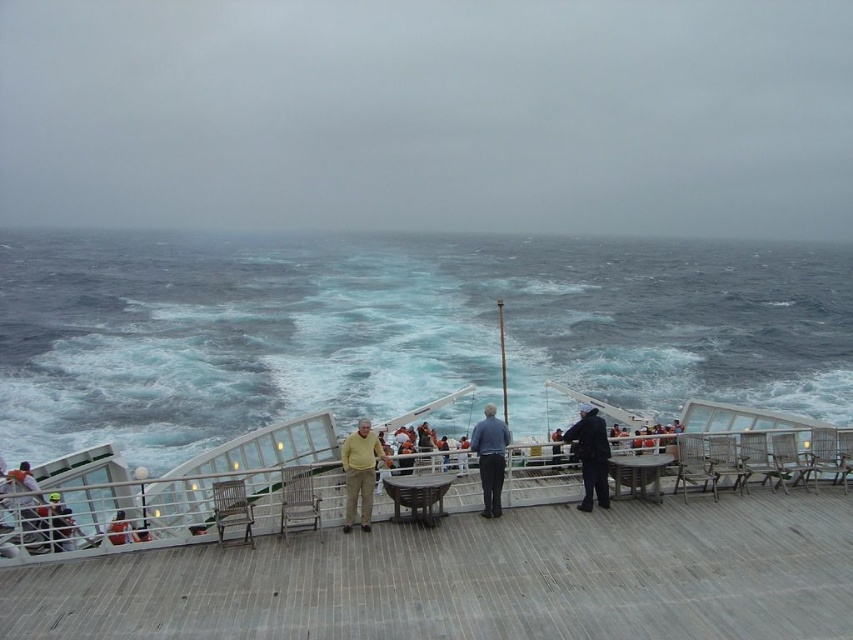
Which is above, dark blue uniform at center or blue denim jacket at center?

blue denim jacket at center

Can you confirm if dark blue uniform at center is thinner than blue denim jacket at center?

No, dark blue uniform at center is not thinner than blue denim jacket at center.

Identify the location of dark blue uniform at center. Image resolution: width=853 pixels, height=640 pixels. [590, 456].

Between point (845, 522) and point (361, 486), which one is positioned behind?

Positioned behind is point (845, 522).

How distant is wooden at center from yellow knit sweater at center?

wooden at center is 11.80 feet from yellow knit sweater at center.

At what (x,y) coordinates should I click in order to perform the action: click on wooden at center. Please return your answer as a coordinate pair (x, y). Looking at the image, I should click on (474, 579).

Does blue water at center appear on the left side of dark blue jacket at center?

In fact, blue water at center is to the right of dark blue jacket at center.

Is point (25, 301) positioned in front of point (556, 461)?

No, (25, 301) is further to viewer.

Where is `blue water at center`? This screenshot has width=853, height=640. blue water at center is located at coordinates (397, 332).